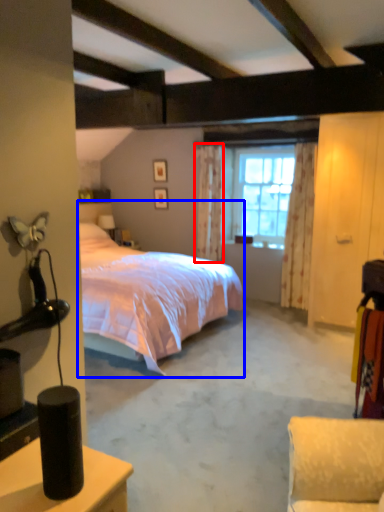
Question: Which point is closer to the camera, curtain (highlighted by a red box) or bed (highlighted by a blue box)?

Choices:
 (A) curtain
 (B) bed

Answer: (B)